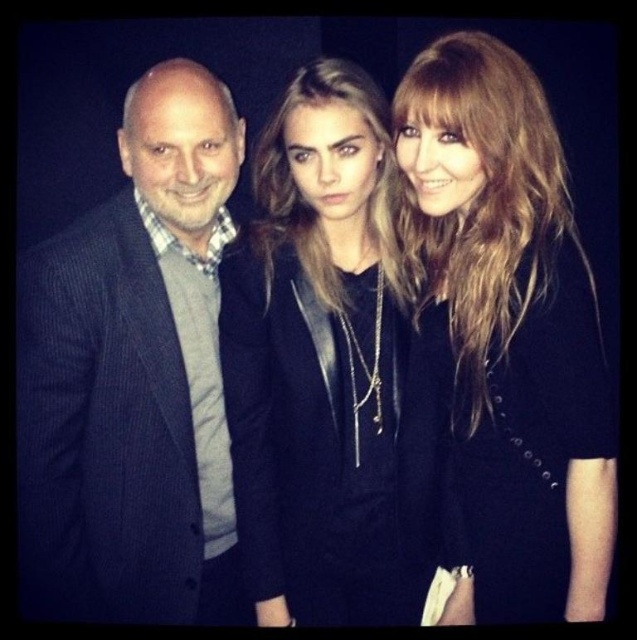
Question: Can you confirm if shiny black coat at center is thinner than black leather jacket at center?

Choices:
 (A) no
 (B) yes

Answer: (B)

Question: Which point appears farthest from the camera in this image?

Choices:
 (A) (254, 449)
 (B) (176, 499)

Answer: (A)

Question: Observing the image, what is the correct spatial positioning of shiny black coat at center in reference to black leather jacket at center?

Choices:
 (A) left
 (B) right

Answer: (B)

Question: Considering the real-world distances, which object is farthest from the black leather jacket at center?

Choices:
 (A) dark pinstriped suit at left
 (B) shiny black coat at center

Answer: (A)

Question: Estimate the real-world distances between objects in this image. Which object is closer to the dark pinstriped suit at left?

Choices:
 (A) black leather jacket at center
 (B) shiny black coat at center

Answer: (A)

Question: Considering the relative positions of dark pinstriped suit at left and shiny black coat at center in the image provided, where is dark pinstriped suit at left located with respect to shiny black coat at center?

Choices:
 (A) left
 (B) right

Answer: (A)